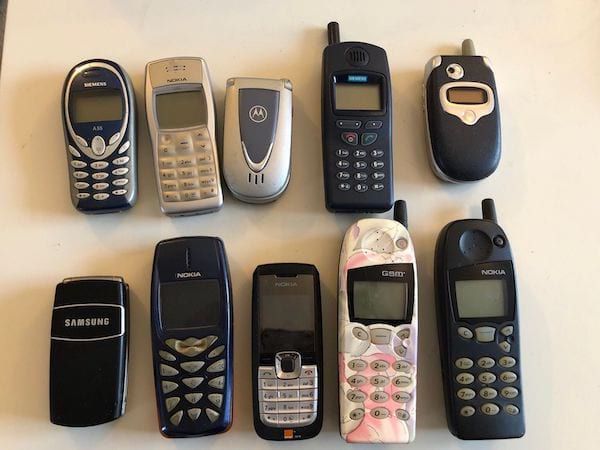
Where is `phones`? The width and height of the screenshot is (600, 450). phones is located at coordinates 116,151, 189,156, 261,150, 343,152, 436,140, 478,248, 393,308, 283,328, 207,328, 101,356.